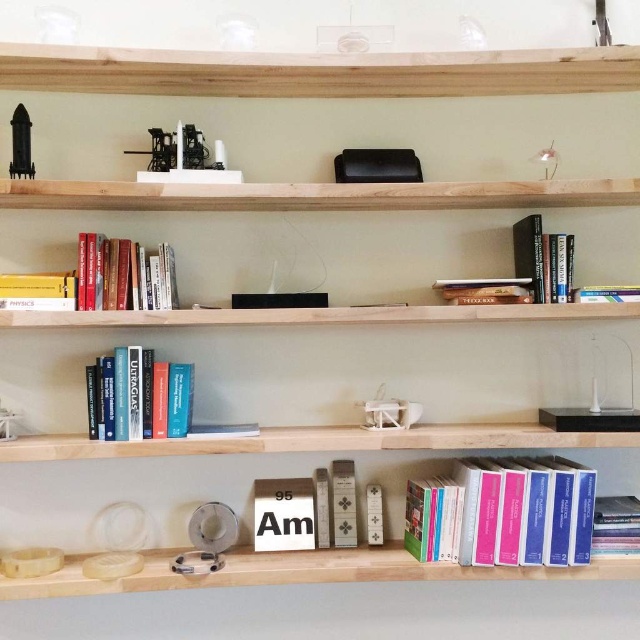
Question: Which object appears closest to the camera in this image?

Choices:
 (A) hardcover book at upper center
 (B) hardcover books at upper left

Answer: (B)

Question: Is hardcover books at center positioned at the back of hardcover book at upper center?

Choices:
 (A) no
 (B) yes

Answer: (A)

Question: Does hardcover books at upper left lie behind blue hardcover books at center?

Choices:
 (A) no
 (B) yes

Answer: (A)

Question: Does hardcover books at center have a smaller size compared to blue hardcover books at center?

Choices:
 (A) no
 (B) yes

Answer: (A)

Question: Which of the following is the farthest from the observer?

Choices:
 (A) (108, 273)
 (B) (465, 547)

Answer: (A)

Question: Which is farther from the hardcover books at upper left?

Choices:
 (A) hardcover books at center
 (B) blue hardcover books at center
 (C) hardcover book at upper center

Answer: (C)